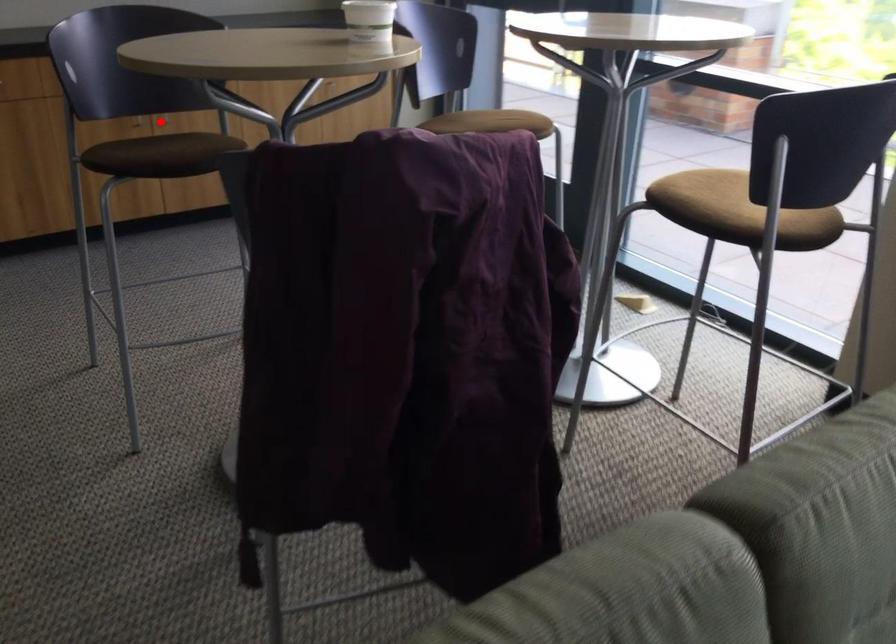
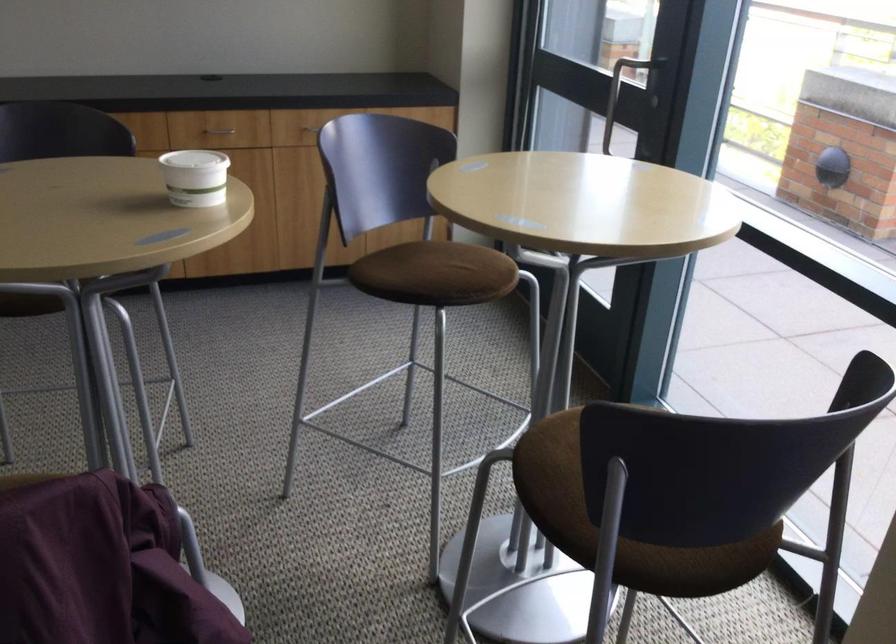
Question: I am providing you with two images of the same scene from different viewpoints. A red point is marked on the first image. Is the red point's position out of view in image 2?

Choices:
 (A) Yes
 (B) No

Answer: (A)